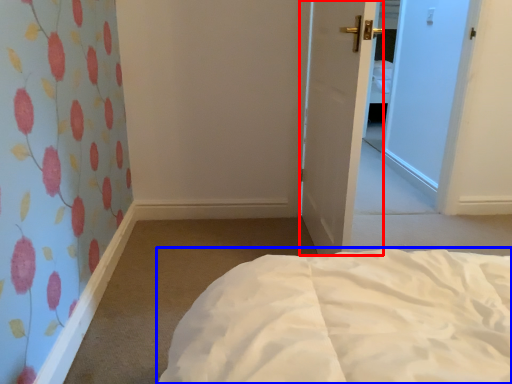
Question: Which object appears farthest to the camera in this image, door (highlighted by a red box) or bed (highlighted by a blue box)?

Choices:
 (A) door
 (B) bed

Answer: (A)